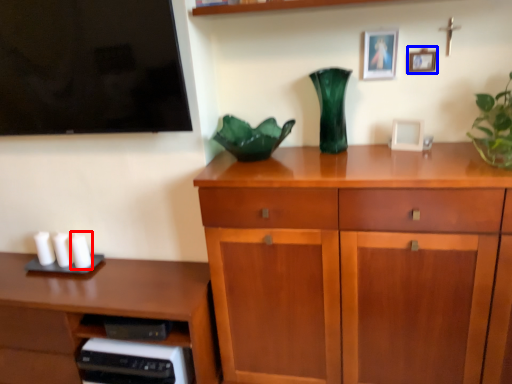
Question: Which of the following is the farthest to the observer, candle (highlighted by a red box) or picture frame (highlighted by a blue box)?

Choices:
 (A) candle
 (B) picture frame

Answer: (A)